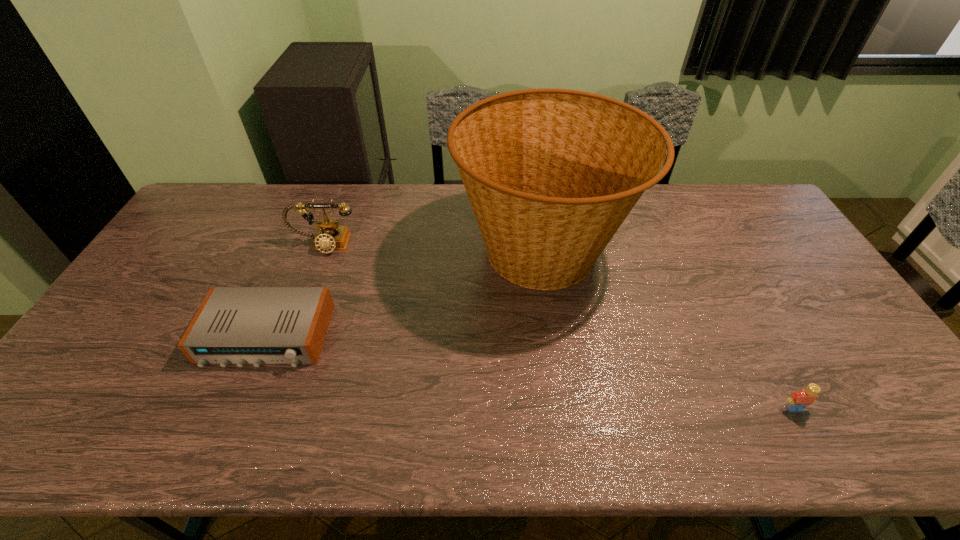
You are a GUI agent. You are given a task and a screenshot of the screen. Output one action in this format:
    pyautogui.click(x=<x>, y=<y>)
    Task: Click on the second object from right to left
    The height and width of the screenshot is (540, 960).
    Given the screenshot: What is the action you would take?
    pyautogui.click(x=551, y=174)

Locate an element on the screen. The width and height of the screenshot is (960, 540). basket is located at coordinates click(551, 174).

Locate an element on the screen. the third shortest object is located at coordinates (331, 236).

Locate an element on the screen. This screenshot has width=960, height=540. the nearest object is located at coordinates (798, 401).

At what (x,y) coordinates should I click in order to perform the action: click on the third tallest object. Please return your answer as a coordinate pair (x, y). The width and height of the screenshot is (960, 540). Looking at the image, I should click on (798, 401).

Identify the location of the shortest object. (234, 325).

The image size is (960, 540). In order to click on free location located 0.210m on the left of the tallest object in this screenshot , I will do `click(388, 252)`.

Locate an element on the screen. Image resolution: width=960 pixels, height=540 pixels. free spot located on the dial number of the third shortest object is located at coordinates (312, 277).

This screenshot has height=540, width=960. Find the location of `free spot located 0.190m on the control panel of the shortest object`. free spot located 0.190m on the control panel of the shortest object is located at coordinates (222, 444).

The width and height of the screenshot is (960, 540). In order to click on object that is at the far edge in this screenshot , I will do `click(551, 174)`.